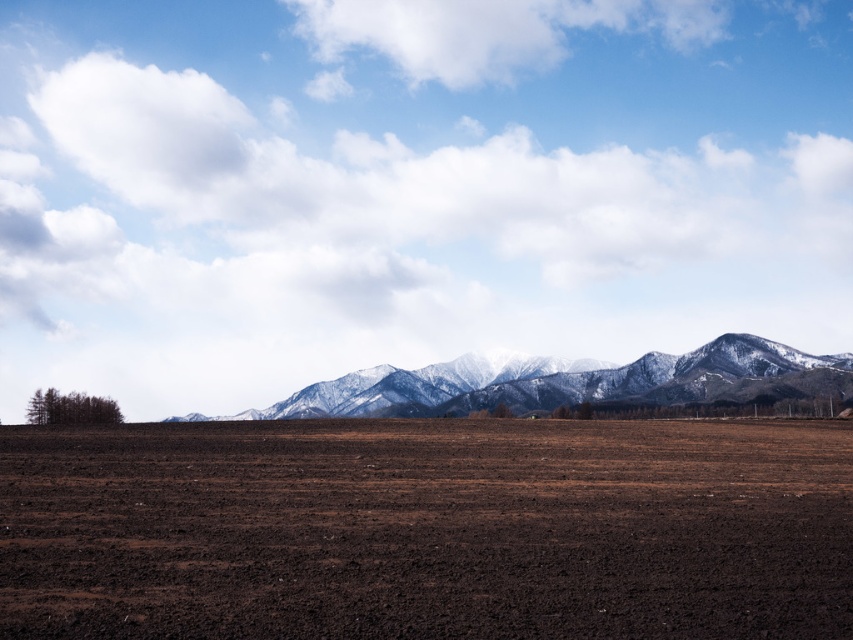
Who is positioned more to the right, brown soil at center or snow-covered mountains at center?

From the viewer's perspective, snow-covered mountains at center appears more on the right side.

Can you confirm if brown soil at center is thinner than snow-covered mountains at center?

Yes.

You are a GUI agent. You are given a task and a screenshot of the screen. Output one action in this format:
    pyautogui.click(x=<x>, y=<y>)
    Task: Click on the brown soil at center
    The image size is (853, 640).
    Given the screenshot: What is the action you would take?
    pyautogui.click(x=427, y=529)

Is point (613, 348) positioned after point (122, 541)?

That is True.

Looking at this image, is white fluffy cloud at upper center closer to the viewer compared to brown soil at center?

No, it is not.

Does point (264, 97) come farther from viewer compared to point (390, 525)?

Yes.

Where is `white fluffy cloud at upper center`? white fluffy cloud at upper center is located at coordinates (410, 188).

Is white fluffy cloud at upper center thinner than snow-covered mountains at center?

No.

Who is more distant from viewer, [494,298] or [404,381]?

The point [494,298] is behind.

This screenshot has height=640, width=853. Describe the element at coordinates (410, 188) in the screenshot. I see `white fluffy cloud at upper center` at that location.

I want to click on white fluffy cloud at upper center, so click(x=410, y=188).